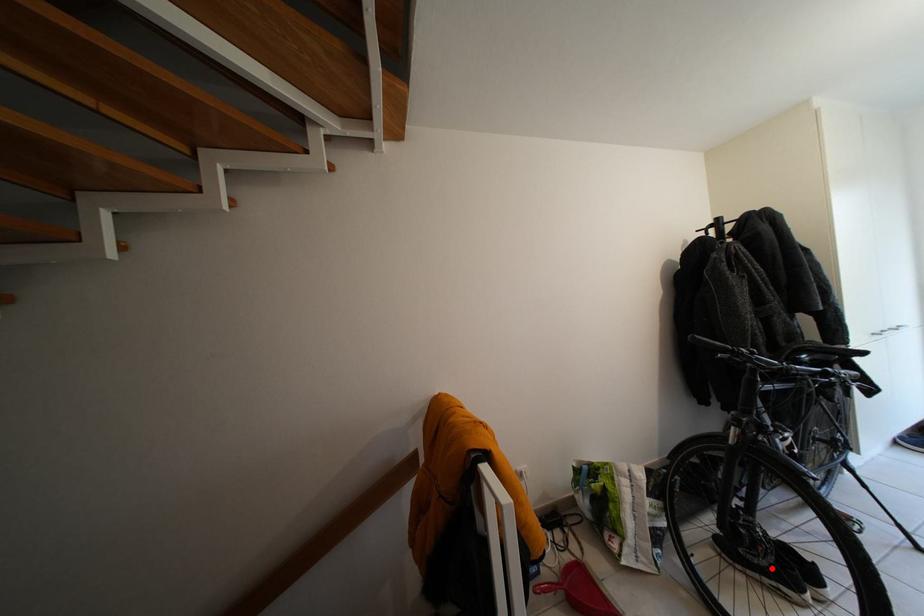
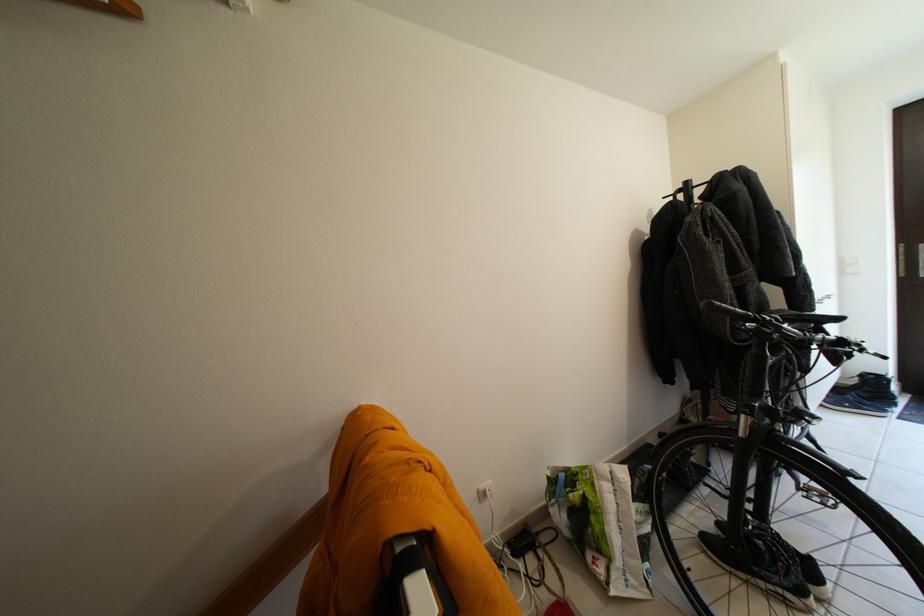
The point at the highlighted location is marked in the first image. Where is the corresponding point in the second image?

(794, 588)